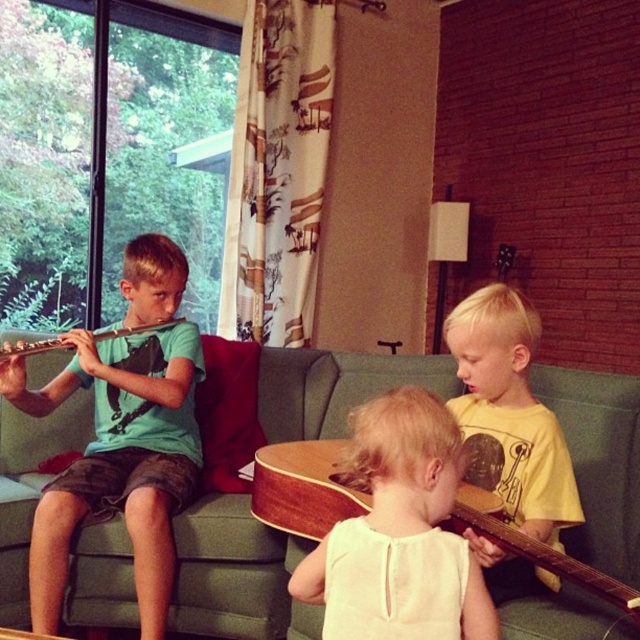
You are a photographer taking a picture of the scene. You want to ensure the light blonde hair at center and the wooden acoustic guitar at center are both visible. Based on their positions, which object is closer to the camera?

The light blonde hair at center is above the wooden acoustic guitar at center, so it is closer to the camera.

You are a photographer setting up a shoot in the living room. You need to position a tall tripod that requires 1.8 meters of clearance height. Based on the scene, will the green fabric couch at center and the light blonde hair at center allow enough space for the tripod?

The green fabric couch at center is not as tall as light blonde hair at center, but the height of the light blonde hair at center is not specified. Without knowing the exact height of the hair, it is impossible to determine if the clearance is sufficient for the tripod requiring 1.8 meters.